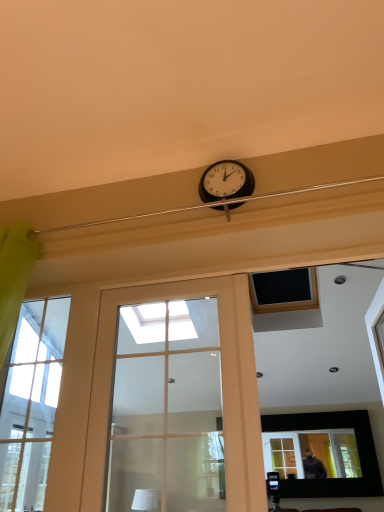
Question: Is matte black picture frame at upper center bigger than matte glass door at center?

Choices:
 (A) no
 (B) yes

Answer: (B)

Question: Does matte black picture frame at upper center have a lesser width compared to matte glass door at center?

Choices:
 (A) yes
 (B) no

Answer: (A)

Question: Does matte black picture frame at upper center come in front of matte glass door at center?

Choices:
 (A) yes
 (B) no

Answer: (B)

Question: Is matte black picture frame at upper center touching matte glass door at center?

Choices:
 (A) yes
 (B) no

Answer: (B)

Question: Is matte black picture frame at upper center positioned with its back to matte glass door at center?

Choices:
 (A) yes
 (B) no

Answer: (B)

Question: Does point (195, 288) appear closer or farther from the camera than point (56, 402)?

Choices:
 (A) closer
 (B) farther

Answer: (A)

Question: Visually, is matte glass door at center positioned to the left or to the right of clear glass window at left?

Choices:
 (A) left
 (B) right

Answer: (B)

Question: Looking at the image, does matte glass door at center seem bigger or smaller compared to clear glass window at left?

Choices:
 (A) small
 (B) big

Answer: (B)

Question: Which is correct: matte glass door at center is inside clear glass window at left, or outside of it?

Choices:
 (A) outside
 (B) inside

Answer: (A)

Question: From the image's perspective, relative to black plastic clock at upper center, is matte black picture frame at upper center above or below?

Choices:
 (A) above
 (B) below

Answer: (B)

Question: Is matte black picture frame at upper center taller or shorter than black plastic clock at upper center?

Choices:
 (A) tall
 (B) short

Answer: (A)

Question: Based on their sizes in the image, would you say matte black picture frame at upper center is bigger or smaller than black plastic clock at upper center?

Choices:
 (A) big
 (B) small

Answer: (A)

Question: In terms of width, does matte black picture frame at upper center look wider or thinner when compared to black plastic clock at upper center?

Choices:
 (A) wide
 (B) thin

Answer: (A)

Question: Considering the positions of point click(x=144, y=493) and point click(x=233, y=192), is point click(x=144, y=493) closer or farther from the camera than point click(x=233, y=192)?

Choices:
 (A) farther
 (B) closer

Answer: (A)

Question: Is white matte lampshade at upper center inside or outside of black plastic clock at upper center?

Choices:
 (A) outside
 (B) inside

Answer: (A)